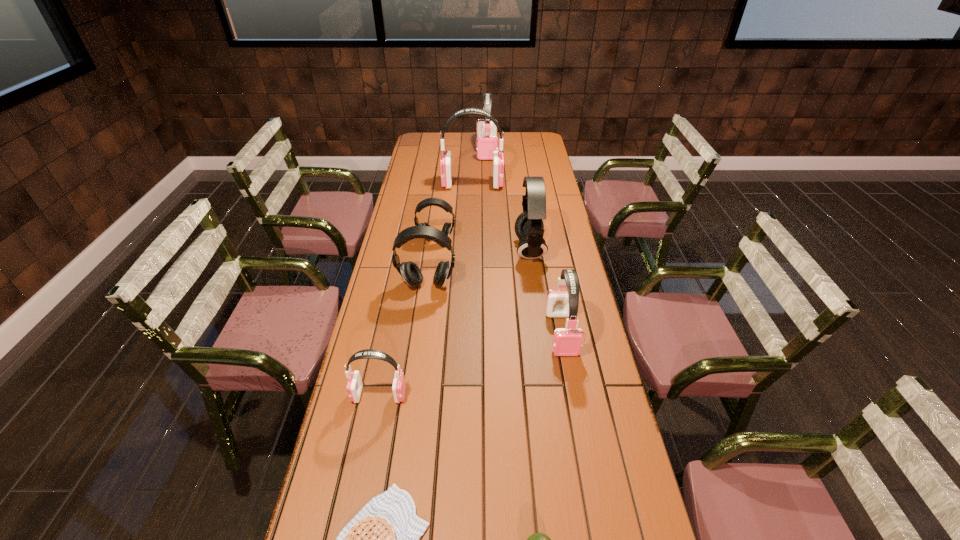
Locate an element on the screen. free space located 0.250m on the outer surface of the third nearest object is located at coordinates (494, 395).

The height and width of the screenshot is (540, 960). Find the location of `object situated at the far edge`. object situated at the far edge is located at coordinates [487, 141].

Image resolution: width=960 pixels, height=540 pixels. I want to click on free location at the left edge, so click(346, 484).

Find the location of a particular element. This screenshot has height=540, width=960. free point at the right edge is located at coordinates (555, 208).

The width and height of the screenshot is (960, 540). What are the coordinates of `vacant space at the far left corner of the desktop` in the screenshot? It's located at (415, 150).

Where is `vacant point located between the nearest earphone and the second nearest pink earphone`? Image resolution: width=960 pixels, height=540 pixels. vacant point located between the nearest earphone and the second nearest pink earphone is located at coordinates (470, 364).

At what (x,y) coordinates should I click in order to perform the action: click on vacant region between the seventh farthest object and the fifth farthest object. Please return your answer as a coordinate pair (x, y). This screenshot has width=960, height=540. Looking at the image, I should click on (403, 340).

This screenshot has height=540, width=960. Identify the location of free space between the farthest earphone and the second biggest black earphone. (457, 218).

At what (x,y) coordinates should I click in order to perform the action: click on free space between the biggest pink earphone and the farthest object. Please return your answer as a coordinate pair (x, y). This screenshot has height=540, width=960. Looking at the image, I should click on (480, 167).

Where is `vacant area that lies between the smallest black earphone and the farthest object`? The image size is (960, 540). vacant area that lies between the smallest black earphone and the farthest object is located at coordinates (462, 195).